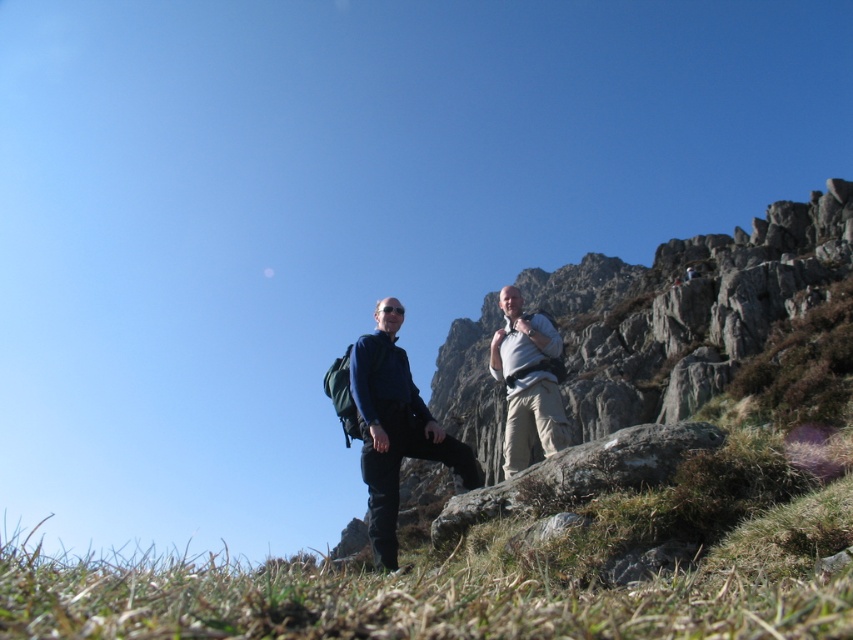
Between green grassy at lower center and dark blue fabric pants at center, which one appears on the left side from the viewer's perspective?

dark blue fabric pants at center is more to the left.

Is point (654, 529) more distant than point (352, 348)?

No, it is not.

The height and width of the screenshot is (640, 853). I want to click on green grassy at lower center, so click(500, 572).

Who is more distant from viewer, (753, 243) or (376, 364)?

The point (753, 243) is more distant.

Does point (621, 397) lie behind point (399, 440)?

Yes, it is.

What are the coordinates of `rugged stone mountain at right` in the screenshot? It's located at [x=686, y=308].

Does green grassy at lower center appear on the right side of light brown canvas backpack at center?

No, green grassy at lower center is not to the right of light brown canvas backpack at center.

Does green grassy at lower center have a larger size compared to light brown canvas backpack at center?

Correct, green grassy at lower center is larger in size than light brown canvas backpack at center.

Is point (773, 524) positioned behind point (521, 300)?

That is False.

The image size is (853, 640). What are the coordinates of `green grassy at lower center` in the screenshot? It's located at (500, 572).